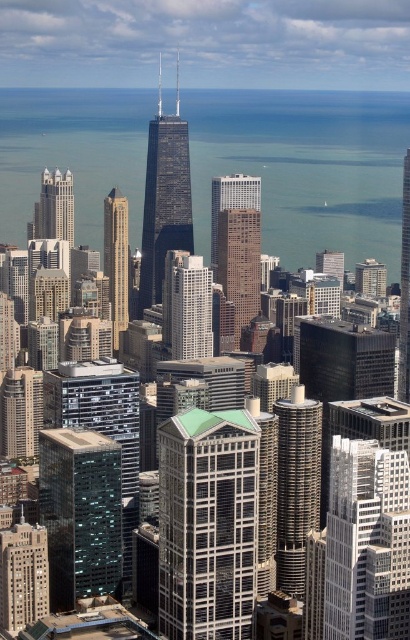
The image size is (410, 640). Find the location of `transparent glass building at lower left`. transparent glass building at lower left is located at coordinates (79, 513).

Consider the image. Does transparent glass building at lower left have a smaller size compared to gray glass skyscraper at center?

Actually, transparent glass building at lower left might be larger than gray glass skyscraper at center.

Locate an element on the screen. The width and height of the screenshot is (410, 640). transparent glass building at lower left is located at coordinates pyautogui.click(x=79, y=513).

Can you confirm if silver metallic tower at center is thinner than matte glass building at lower left?

Yes, silver metallic tower at center is thinner than matte glass building at lower left.

Is point (314, 512) positioned before point (36, 552)?

Yes.

Measure the distance between silver metallic tower at center and camera.

silver metallic tower at center is 642.04 meters from camera.

The width and height of the screenshot is (410, 640). What are the coordinates of `silver metallic tower at center` in the screenshot? It's located at tap(296, 484).

Which is more to the right, transparent glass building at lower left or brown glassy skyscraper at center?

Positioned to the right is brown glassy skyscraper at center.

Based on the photo, does transparent glass building at lower left appear under brown glassy skyscraper at center?

Yes, transparent glass building at lower left is below brown glassy skyscraper at center.

Which is in front, point (88, 492) or point (232, 275)?

Point (232, 275)

Identify the location of transparent glass building at lower left. The width and height of the screenshot is (410, 640). (79, 513).